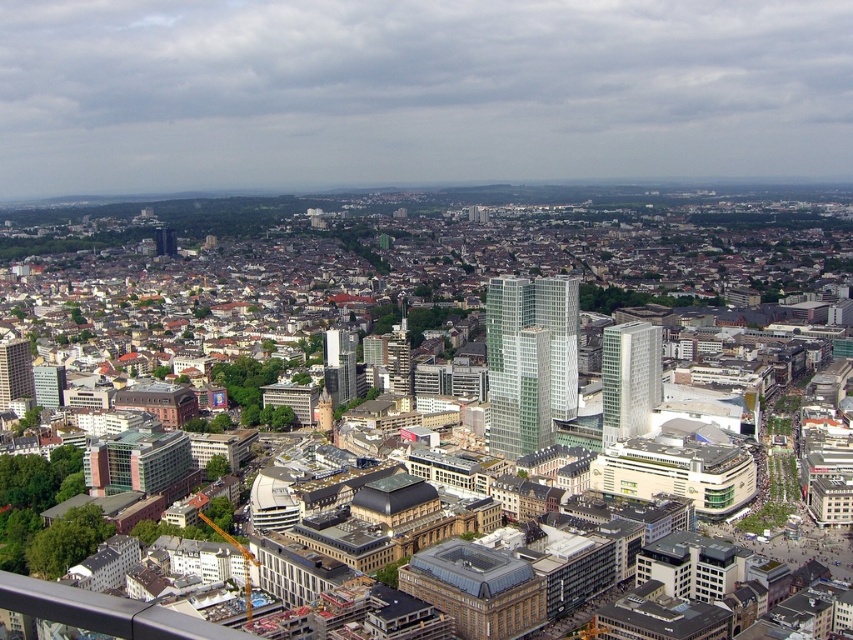
Question: Can you confirm if glassy skyscraper at center is positioned to the right of matte glass skyscraper at center-left?

Choices:
 (A) yes
 (B) no

Answer: (A)

Question: Is white glass skyscraper at center wider than matte glass skyscraper at center-left?

Choices:
 (A) yes
 (B) no

Answer: (A)

Question: Which point is farther to the camera?

Choices:
 (A) glassy silver skyscraper at center
 (B) white glass skyscraper at center
 (C) glassy skyscraper at center
 (D) matte glass skyscraper at center-left

Answer: (C)

Question: Based on their relative distances, which object is nearer to the white glass skyscraper at center?

Choices:
 (A) glassy skyscraper at center
 (B) matte glass skyscraper at center-left

Answer: (A)

Question: Which object is closer to the camera taking this photo?

Choices:
 (A) matte glass skyscraper at center-left
 (B) white glass skyscraper at center
 (C) glassy silver skyscraper at center
 (D) glassy skyscraper at center

Answer: (B)

Question: Observing the image, what is the correct spatial positioning of glassy silver skyscraper at center in reference to matte glass skyscraper at center-left?

Choices:
 (A) below
 (B) above

Answer: (B)